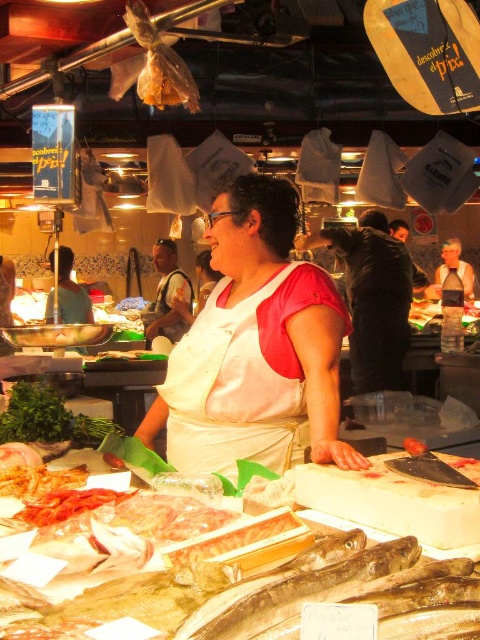
Question: Does white matte apron at center appear under shiny silver fish at center?

Choices:
 (A) no
 (B) yes

Answer: (A)

Question: Does white fabric apron at center have a lesser width compared to shiny silver fish at center?

Choices:
 (A) yes
 (B) no

Answer: (B)

Question: Which point is closer to the camera?

Choices:
 (A) (x=322, y=561)
 (B) (x=186, y=352)
 (C) (x=296, y=385)

Answer: (A)

Question: From the image, what is the correct spatial relationship of white fabric apron at center in relation to matte white apron at center?

Choices:
 (A) above
 (B) below

Answer: (B)

Question: Among these points, which one is nearest to the camera?

Choices:
 (A) (445, 257)
 (B) (267, 458)
 (C) (250, 586)
 (D) (190, 444)

Answer: (C)

Question: Which object is positioned closest to the matte white apron at center?

Choices:
 (A) white fabric apron at center
 (B) white matte apron at center
 (C) shiny silver fish at center

Answer: (B)